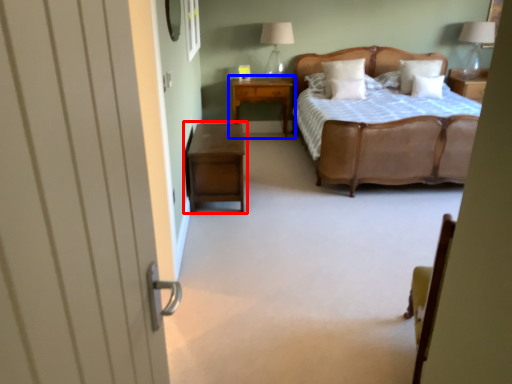
Question: Which object appears closest to the camera in this image, nightstand (highlighted by a red box) or nightstand (highlighted by a blue box)?

Choices:
 (A) nightstand
 (B) nightstand

Answer: (A)